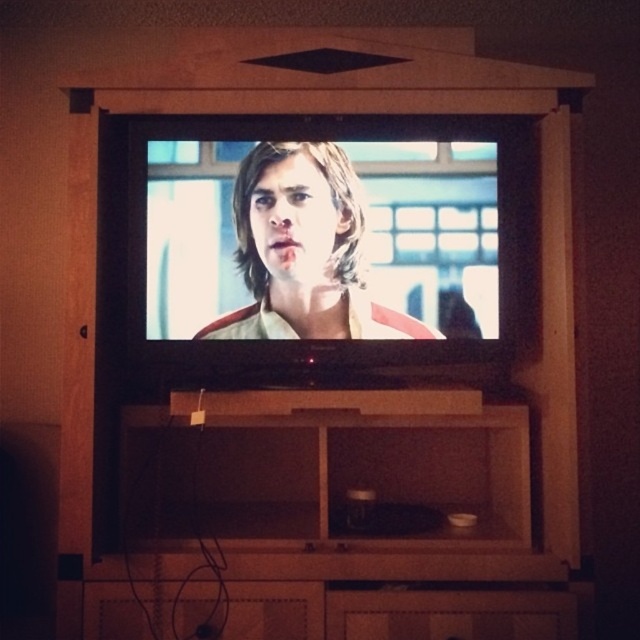
What do you see at coordinates (305, 250) in the screenshot? This screenshot has height=640, width=640. I see `matte black shirt at center` at bounding box center [305, 250].

Looking at this image, which is above, matte black shirt at center or matte wood drawer at lower center?

matte black shirt at center is above.

Is point (237, 260) closer to viewer compared to point (392, 634)?

That is False.

The width and height of the screenshot is (640, 640). I want to click on matte black shirt at center, so click(x=305, y=250).